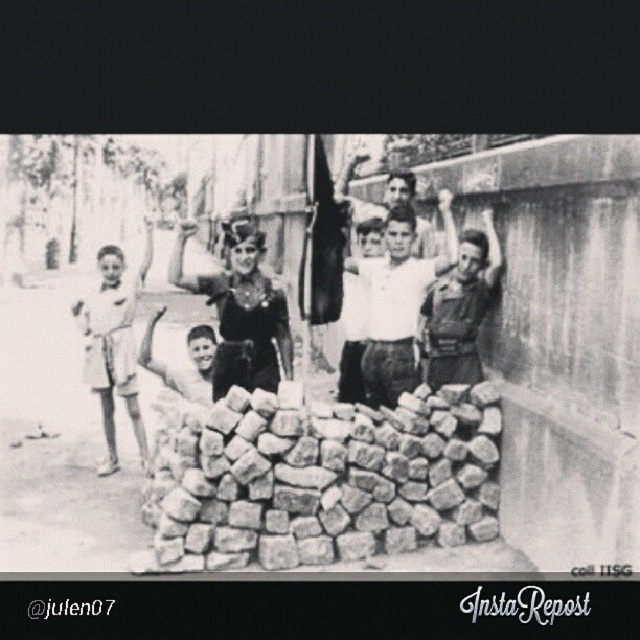
Is smooth skin boy at center thinner than smooth fabric shirt at center?

Yes.

Does point (237, 384) lie behind point (346, 193)?

That is False.

I want to click on smooth skin boy at center, so click(189, 358).

Which is below, white cotton shirt at center or matte black uniform at right?

matte black uniform at right

Can you confirm if white cotton shirt at center is shorter than matte black uniform at right?

No, white cotton shirt at center is not shorter than matte black uniform at right.

Which is behind, point (385, 384) or point (460, 289)?

The point (385, 384) is more distant.

This screenshot has width=640, height=640. I want to click on white cotton shirt at center, so (397, 300).

Does white cotton shirt at center appear over smooth skin boy at center?

Yes, white cotton shirt at center is above smooth skin boy at center.

Does white cotton shirt at center have a smaller size compared to smooth skin boy at center?

Actually, white cotton shirt at center might be larger than smooth skin boy at center.

Locate an element on the screen. This screenshot has height=640, width=640. white cotton shirt at center is located at coordinates (397, 300).